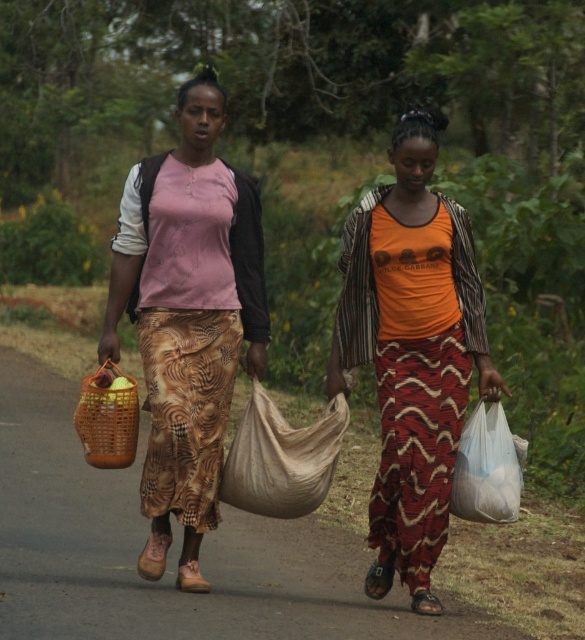
You are a delivery person who needs to choose a bag to carry a large package. You see the matte brown woven basket at left and the white plastic bag at right. Which bag can better accommodate the large package based on their sizes?

The matte brown woven basket at left has a larger size compared to the white plastic bag at right, so it can better accommodate the large package.